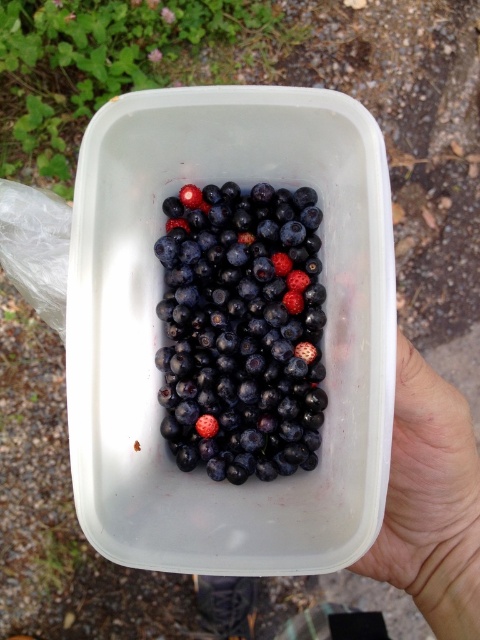
Question: Can you confirm if shiny dark blue berries at center is positioned to the left of glossy blueberry at center?

Choices:
 (A) no
 (B) yes

Answer: (A)

Question: Is shiny dark blue berries at center above white smooth hand at lower right?

Choices:
 (A) no
 (B) yes

Answer: (B)

Question: Which object is farther from the camera taking this photo?

Choices:
 (A) white smooth hand at lower right
 (B) shiny dark blue berries at center
 (C) glossy blueberry at center

Answer: (C)

Question: Is white smooth hand at lower right smaller than glossy blueberry at center?

Choices:
 (A) no
 (B) yes

Answer: (A)

Question: Which is nearer to the shiny dark blue berries at center?

Choices:
 (A) glossy blueberry at center
 (B) white smooth hand at lower right

Answer: (A)

Question: Which point is farther from the camera taking this photo?

Choices:
 (A) (245, 352)
 (B) (377, 541)
 (C) (194, 428)

Answer: (C)